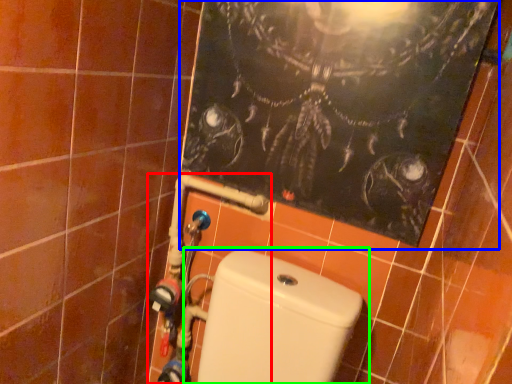
Question: Based on their relative distances, which object is farther from water pipe (highlighted by a red box)? Choose from bulletin board (highlighted by a blue box) and toilet (highlighted by a green box).

Choices:
 (A) bulletin board
 (B) toilet

Answer: (A)